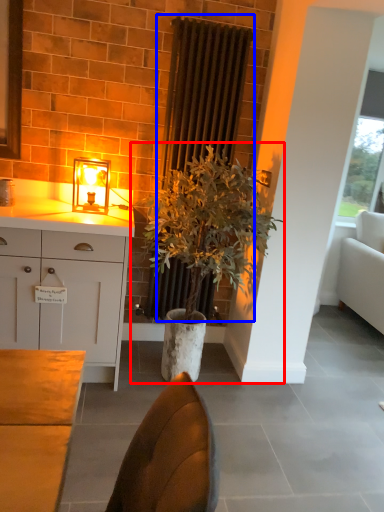
Question: Which object appears farthest to the camera in this image, houseplant (highlighted by a red box) or radiator (highlighted by a blue box)?

Choices:
 (A) houseplant
 (B) radiator

Answer: (B)